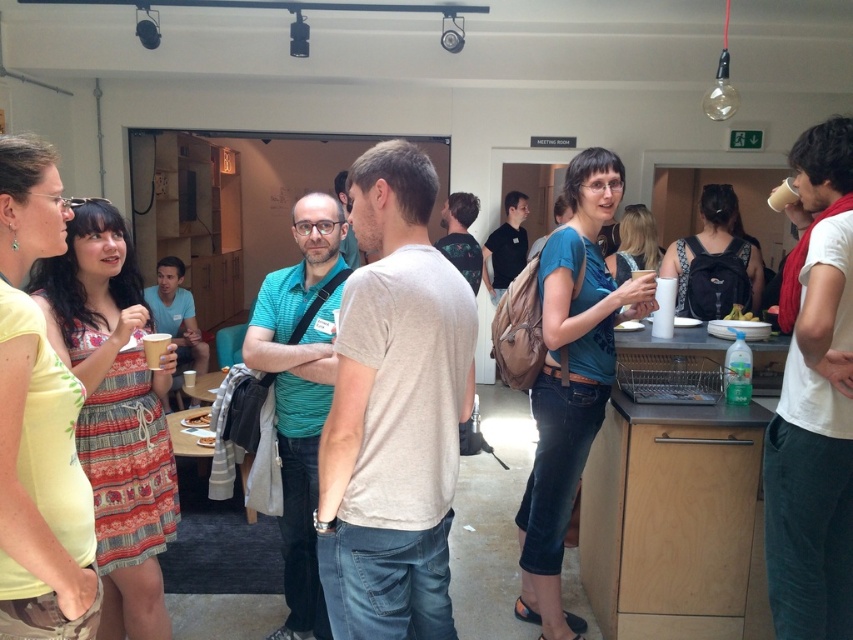
Question: From the image, what is the correct spatial relationship of matte blue shirt at center in relation to green matte broccoli at right?

Choices:
 (A) below
 (B) above

Answer: (A)

Question: Is matte blue shirt at center bigger than green matte broccoli at right?

Choices:
 (A) no
 (B) yes

Answer: (B)

Question: Where is matte blue shirt at center located in relation to green matte broccoli at right in the image?

Choices:
 (A) below
 (B) above

Answer: (A)